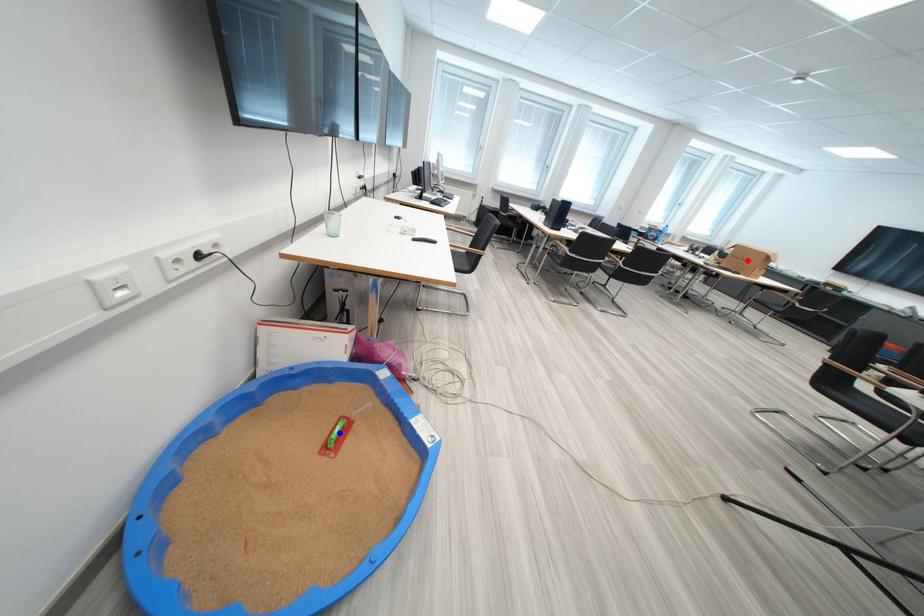
Question: Which of the two points in the image is closer to the camera?

Choices:
 (A) Blue point is closer.
 (B) Red point is closer.

Answer: (A)